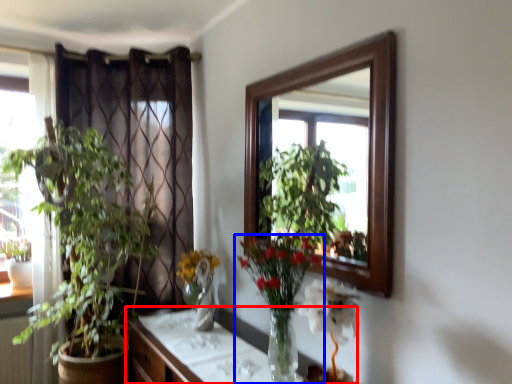
Question: Which of the following is the closest to the observer, cabinetry (highlighted by a red box) or houseplant (highlighted by a blue box)?

Choices:
 (A) cabinetry
 (B) houseplant

Answer: (A)